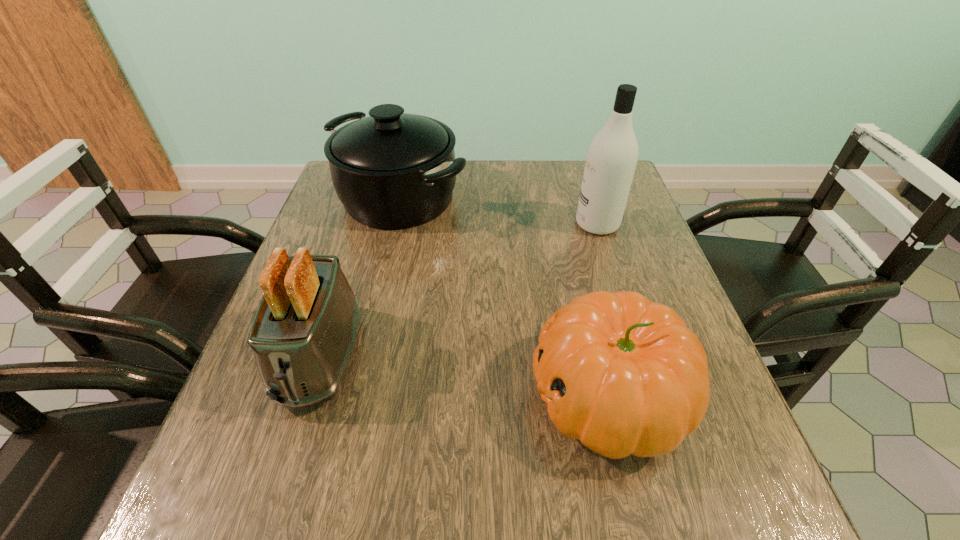
Where is `free space between the pumpkin and the toaster`? free space between the pumpkin and the toaster is located at coordinates (465, 375).

Image resolution: width=960 pixels, height=540 pixels. Identify the location of vacant area between the toaster and the shortest object. (465, 375).

The image size is (960, 540). I want to click on unoccupied area between the toaster and the saucepan, so click(x=360, y=277).

Where is `unoccupied position between the shampoo and the saucepan`? unoccupied position between the shampoo and the saucepan is located at coordinates (498, 211).

Where is `unoccupied area between the toaster and the tallest object`? unoccupied area between the toaster and the tallest object is located at coordinates (459, 290).

Locate an element on the screen. object that is the nearest to the saucepan is located at coordinates (304, 331).

This screenshot has height=540, width=960. I want to click on object identified as the closest to the shampoo, so click(392, 170).

Locate an element on the screen. The width and height of the screenshot is (960, 540). free space that satisfies the following two spatial constraints: 1. on the front-facing side of the shampoo; 2. on the side of the toaster with the control lever is located at coordinates (638, 356).